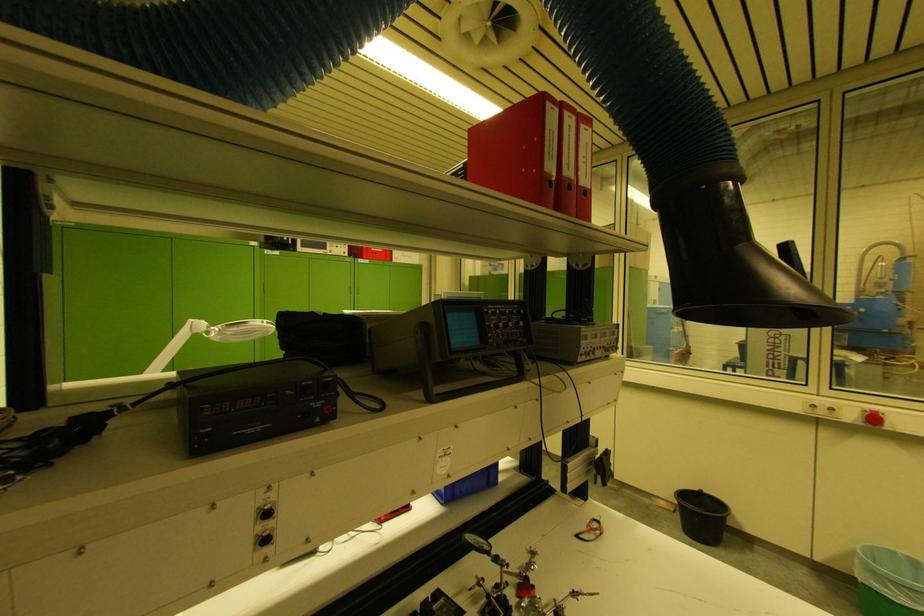
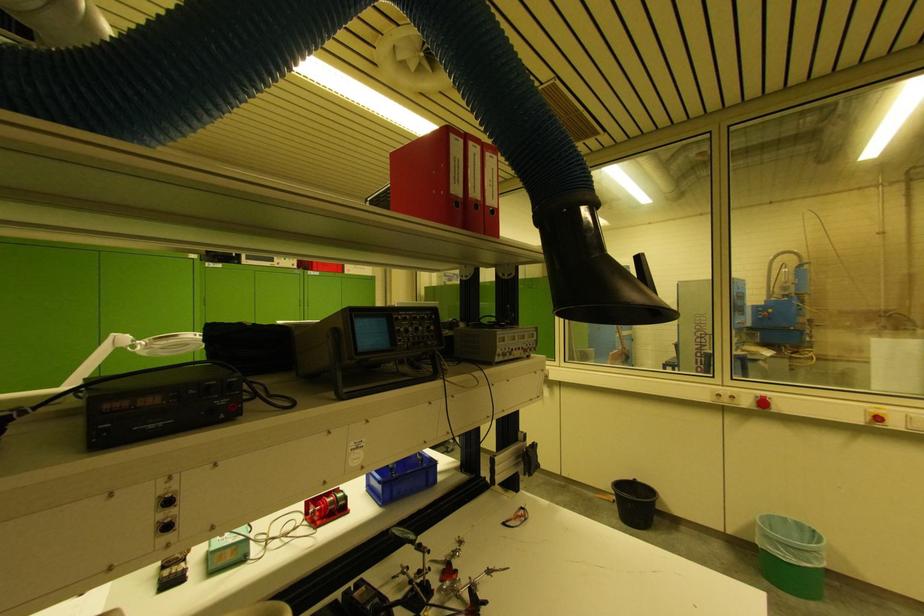
What movement of the cameraman would produce the second image?

The cameraman walked toward right, backward.